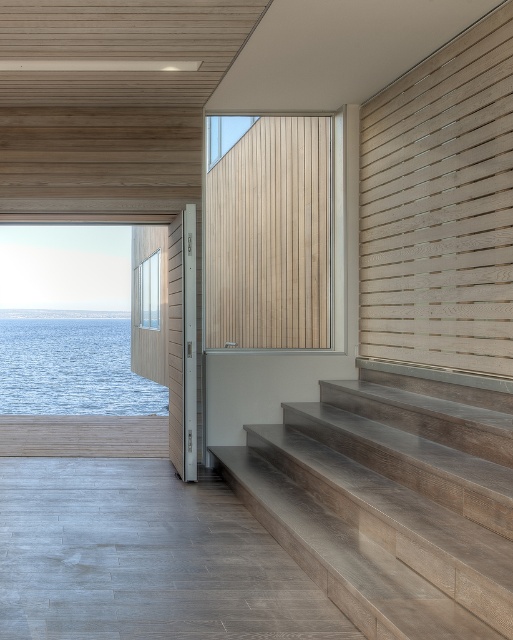
You are standing at the entrance of the room and want to go down to the covered outdoor area. Where are the wooden textured stairs at lower right located?

The wooden textured stairs at lower right are located at point (391, 500).

You are standing on the main floor of this modern space and want to reach the blue water at left. The wooden textured stairs at lower right are in your way. Can you walk around the stairs to access the water directly?

The wooden textured stairs at lower right is shorter than blue water at left, so you can walk around the stairs to access the blue water at left directly since the stairs are lower in height compared to the water level.